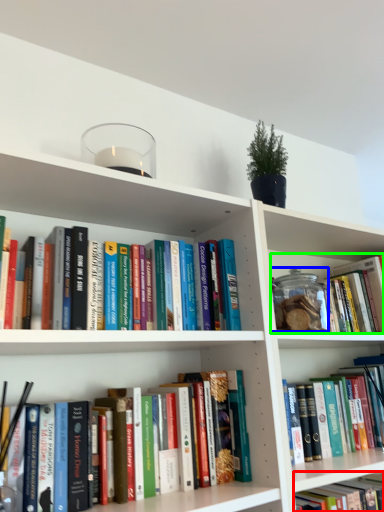
Question: Considering the real-world distances, which object is farthest from book (highlighted by a red box)? glass jar (highlighted by a blue box) or book (highlighted by a green box)?

Choices:
 (A) glass jar
 (B) book

Answer: (B)